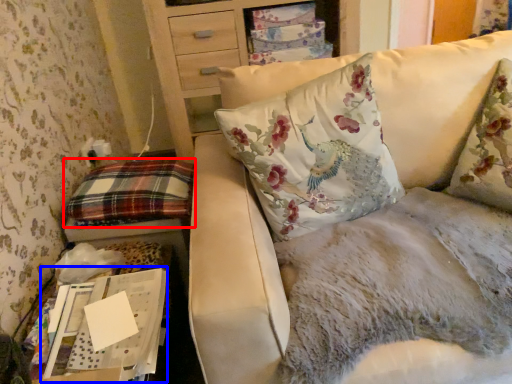
Question: Which of the following is the closest to the observer, pillow (highlighted by a red box) or cardboard box (highlighted by a blue box)?

Choices:
 (A) pillow
 (B) cardboard box

Answer: (B)